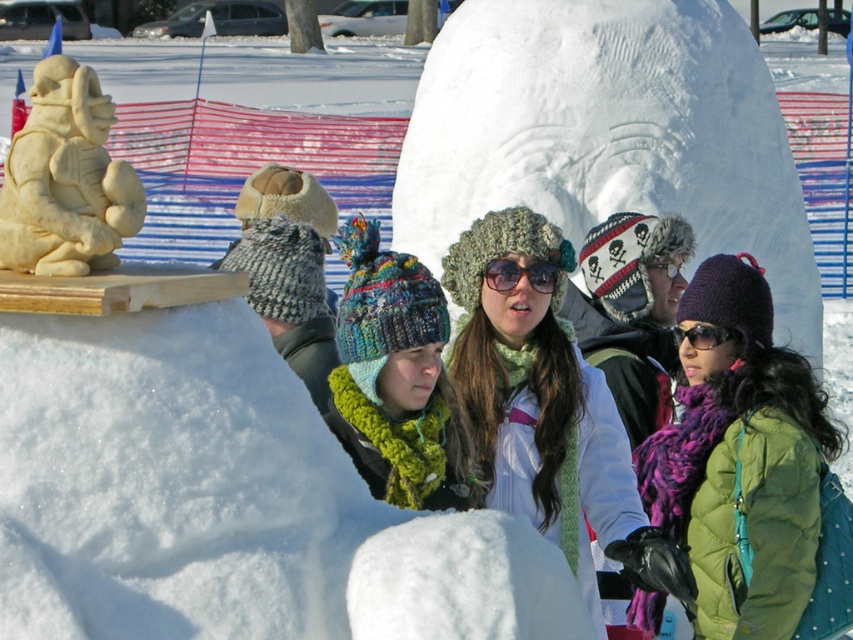
You are standing at the snow sculpture event and want to take a photo that includes both the main snow sculpture and the smaller seated figure. Which point, point (607, 186) or point (13, 216), is closer to you and should be framed first in your camera view?

Point (607, 186) is further to the viewer than point (13, 216), so the point closer to you is point (13, 216). To frame both in your camera view, ensure the closer point (13, 216) is positioned first in your shot, followed by the further point (607, 186).